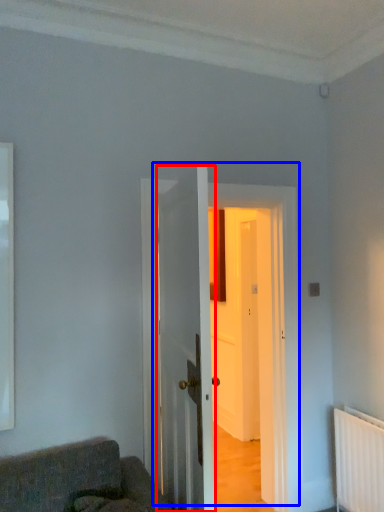
Question: Which of the following is the closest to the observer, door (highlighted by a red box) or door (highlighted by a blue box)?

Choices:
 (A) door
 (B) door

Answer: (A)